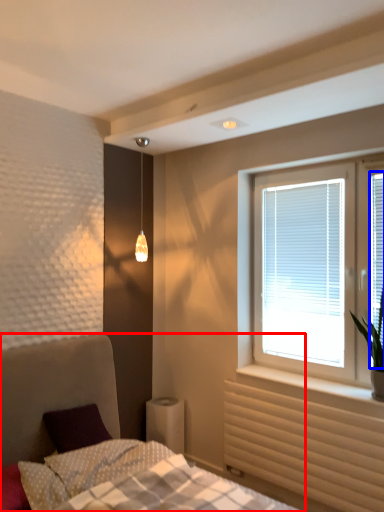
Question: Which object appears closest to the camera in this image, bed (highlighted by a red box) or window screen (highlighted by a blue box)?

Choices:
 (A) bed
 (B) window screen

Answer: (A)